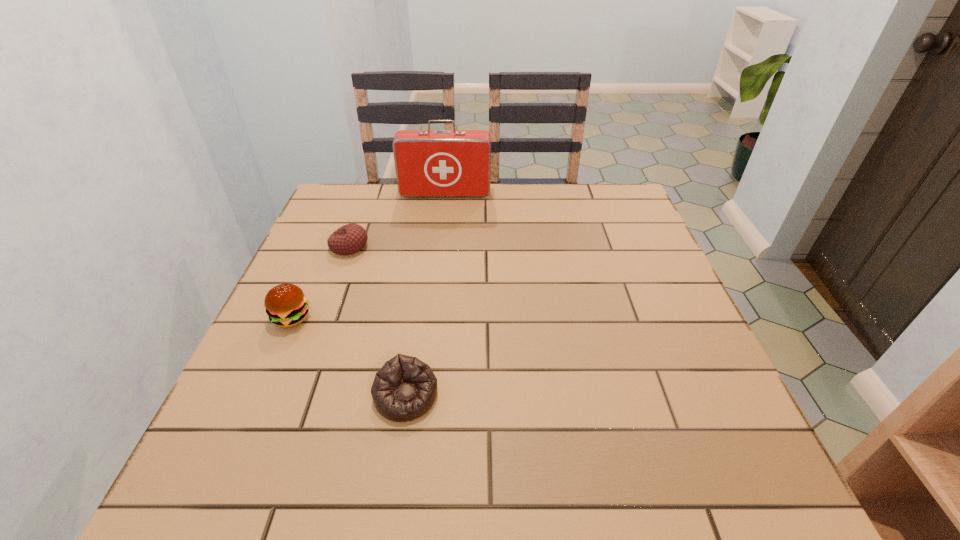
This screenshot has width=960, height=540. What are the coordinates of `free spot between the first-aid kit and the nearest object` in the screenshot? It's located at (425, 295).

In order to click on blank region between the right beanbag and the farther beanbag in this screenshot , I will do `click(377, 321)`.

The height and width of the screenshot is (540, 960). Find the location of `the third closest object to the nearest object`. the third closest object to the nearest object is located at coordinates (429, 163).

Where is `object that stands as the closest to the right beanbag`? This screenshot has width=960, height=540. object that stands as the closest to the right beanbag is located at coordinates (286, 305).